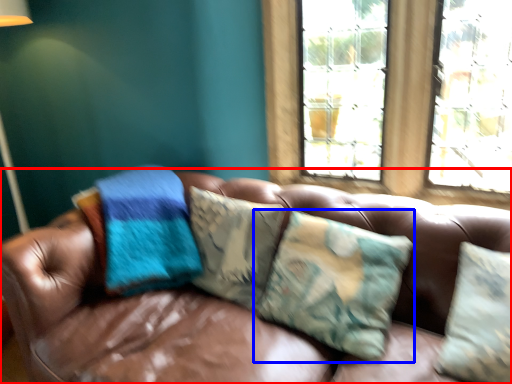
Question: Which object appears closest to the camera in this image, studio couch (highlighted by a red box) or pillow (highlighted by a blue box)?

Choices:
 (A) studio couch
 (B) pillow

Answer: (A)